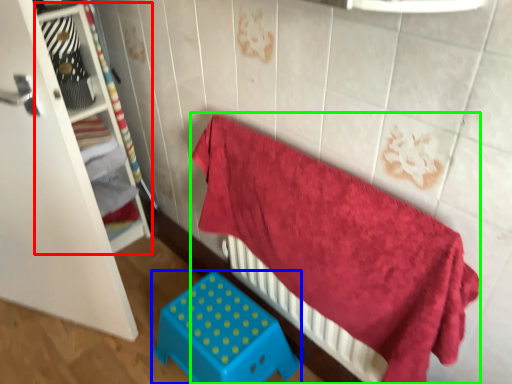
Question: Estimate the real-world distances between objects in this image. Which object is closer to shelf (highlighted by a red box), furniture (highlighted by a blue box) or bed (highlighted by a green box)?

Choices:
 (A) furniture
 (B) bed

Answer: (A)